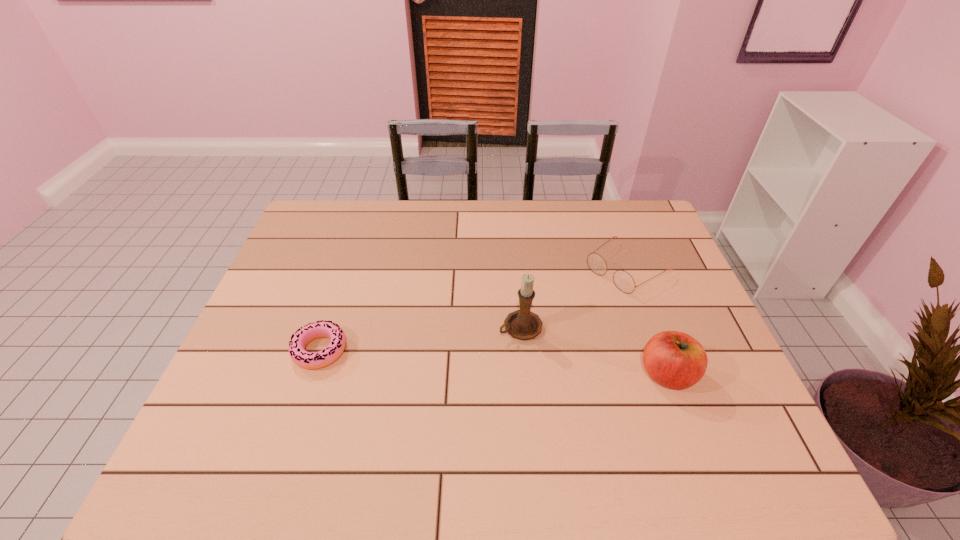
At what (x,y) coordinates should I click in order to perform the action: click on vacant space in between the shortest object and the tallest object. Please return your answer as a coordinate pair (x, y). Looking at the image, I should click on (420, 339).

The height and width of the screenshot is (540, 960). I want to click on free spot between the leftmost object and the second tallest object, so 493,362.

In order to click on vacant area that lies between the apple and the shortest object in this screenshot , I will do `click(493, 362)`.

This screenshot has width=960, height=540. Identify the location of vacant area between the second tallest object and the third tallest object. (647, 322).

This screenshot has height=540, width=960. I want to click on object identified as the closest to the tallest object, so click(624, 282).

The image size is (960, 540). Identify the location of the third closest object to the third tallest object. [309, 360].

The image size is (960, 540). In order to click on vacant space that satisfies the following two spatial constraints: 1. on the back side of the third tallest object; 2. on the right side of the tallest object in this screenshot , I will do `click(516, 269)`.